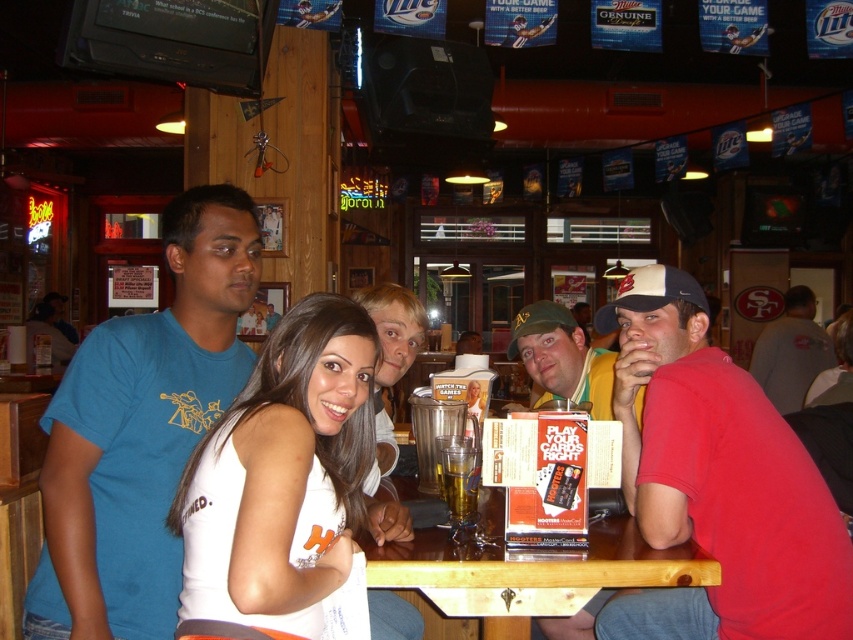
You are a waiter trying to deliver a drink to the table. The red cotton shirt at center and the wooden at center are in your path. Which object should you navigate around first?

You should navigate around the red cotton shirt at center first because it is closer to you than the wooden at center, which is further away.

You are a customer at the restaurant and want to place your drink on the wooden at center without it falling off. Considering the white fabric baseball cap at upper right is nearby, which object should you choose to place your drink on and why?

The wooden at center is much taller than the white fabric baseball cap at upper right, so placing the drink on the wooden at center would provide a more stable and elevated surface, reducing the risk of it falling off.